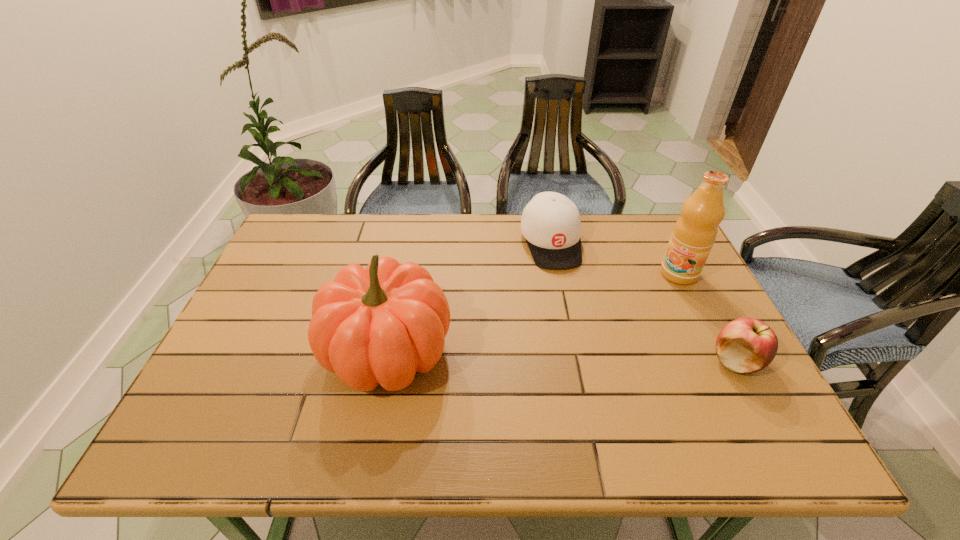
At what (x,y) coordinates should I click in order to perform the action: click on free space on the desktop that is between the leftmost object and the apple and is positioned on the front-facing side of the baseball cap. Please return your answer as a coordinate pair (x, y). Image resolution: width=960 pixels, height=540 pixels. Looking at the image, I should click on (592, 357).

In order to click on free space on the desktop that is between the leftmost object and the apple and is positioned on the front label of the fruit juice in this screenshot , I will do `click(591, 357)`.